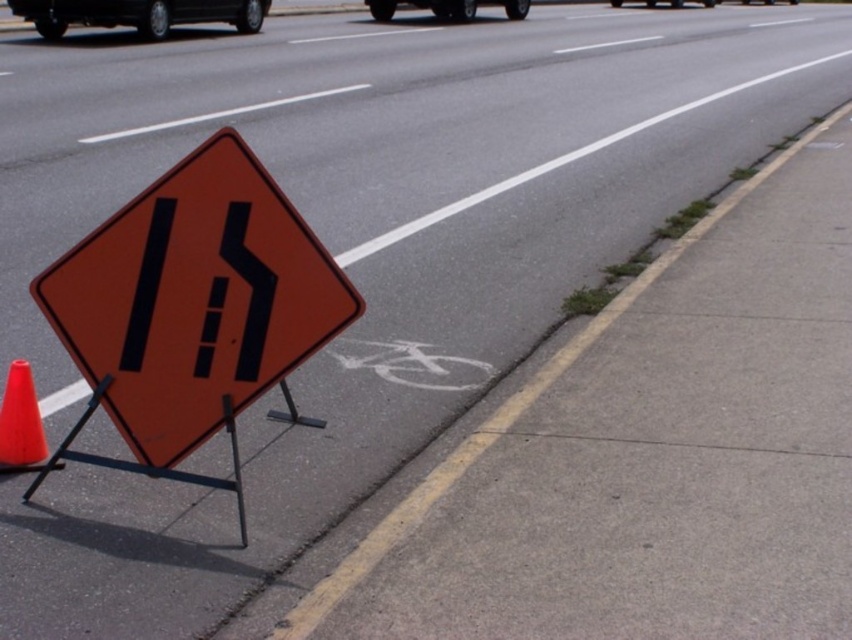
Question: Is black rubber car at upper left in front of metallic silver car at upper center?

Choices:
 (A) no
 (B) yes

Answer: (B)

Question: Does orange plastic traffic cone at lower left have a larger size compared to metallic silver car at upper center?

Choices:
 (A) no
 (B) yes

Answer: (A)

Question: Which point appears closest to the camera in this image?

Choices:
 (A) (79, 339)
 (B) (148, 10)
 (C) (614, 0)
 (D) (429, 1)

Answer: (A)

Question: Is white painted bike lane at lower center closer to the viewer compared to orange plastic traffic cone at lower left?

Choices:
 (A) yes
 (B) no

Answer: (B)

Question: Among these objects, which one is farthest from the camera?

Choices:
 (A) white painted bike lane at lower center
 (B) metallic silver car at upper center

Answer: (B)

Question: Which point is farther to the camera?

Choices:
 (A) black rubber car at center
 (B) orange plastic traffic cone at lower left
 (C) metallic silver car at upper center

Answer: (A)